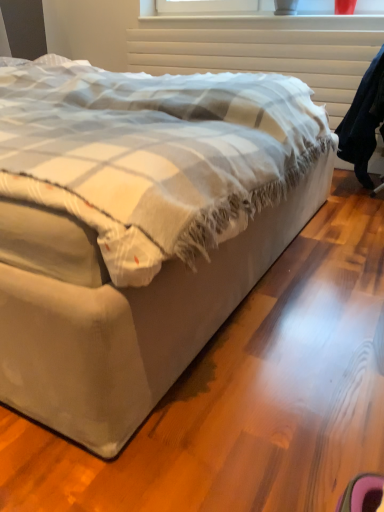
Question: Is dark blue fabric robe at right at the back of beige fabric bed at center?

Choices:
 (A) no
 (B) yes

Answer: (A)

Question: Does beige fabric bed at center have a lesser width compared to dark blue fabric robe at right?

Choices:
 (A) yes
 (B) no

Answer: (B)

Question: Is beige fabric bed at center taller than dark blue fabric robe at right?

Choices:
 (A) yes
 (B) no

Answer: (A)

Question: Can you confirm if beige fabric bed at center is positioned to the left of dark blue fabric robe at right?

Choices:
 (A) yes
 (B) no

Answer: (A)

Question: Is beige fabric bed at center closer to the viewer compared to dark blue fabric robe at right?

Choices:
 (A) yes
 (B) no

Answer: (A)

Question: Does beige fabric bed at center appear on the right side of dark blue fabric robe at right?

Choices:
 (A) no
 (B) yes

Answer: (A)

Question: Does dark blue fabric robe at right have a greater height compared to beige fabric bed at center?

Choices:
 (A) no
 (B) yes

Answer: (A)

Question: Is dark blue fabric robe at right positioned before beige fabric bed at center?

Choices:
 (A) no
 (B) yes

Answer: (A)

Question: Can you confirm if dark blue fabric robe at right is positioned to the right of beige fabric bed at center?

Choices:
 (A) yes
 (B) no

Answer: (A)

Question: Can you confirm if dark blue fabric robe at right is positioned to the left of beige fabric bed at center?

Choices:
 (A) yes
 (B) no

Answer: (B)

Question: Considering the relative sizes of dark blue fabric robe at right and beige fabric bed at center in the image provided, is dark blue fabric robe at right smaller than beige fabric bed at center?

Choices:
 (A) yes
 (B) no

Answer: (A)

Question: Can you confirm if dark blue fabric robe at right is wider than beige fabric bed at center?

Choices:
 (A) yes
 (B) no

Answer: (B)

Question: Can you confirm if beige fabric bed at center is positioned to the left of white textured radiator at upper center?

Choices:
 (A) no
 (B) yes

Answer: (B)